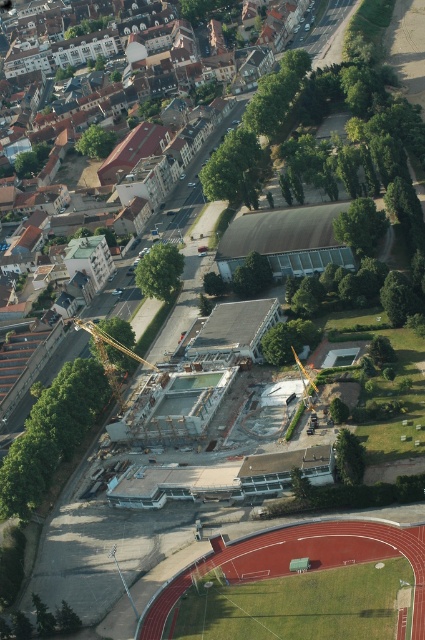
You are a drone operator flying over the urban area shown in the image. You need to deliver a package to both the point at coordinates point (147, 627) and the point at coordinates point (76, 324). Which point should you visit first if you want to minimize your flight distance?

You should visit point (147, 627) first because it is closer to the camera, so the flight distance from the current position would be shorter.

You are a drone operator tasked with capturing aerial footage of the green grass football field at lower center. Your drone has a maximum flight range of 120 meters. Can your drone safely reach the field and return without exceeding its range limit?

The distance between the green grass football field at lower center and the camera is 119.97 meters. Since the drone can fly up to 120 meters, it can safely reach the field and return within the range limit.

You are a city planner assessing the layout of this area. You need to ensure that the gold metallic crane at center can safely operate without encroaching on the green grass football field at lower center. What is the minimum safe distance required between the crane and the field according to safety regulations?

The minimum safe distance required between the gold metallic crane at center and the green grass football field at lower center is 43.68 meters, which is the current distance between them. This distance meets safety regulations.